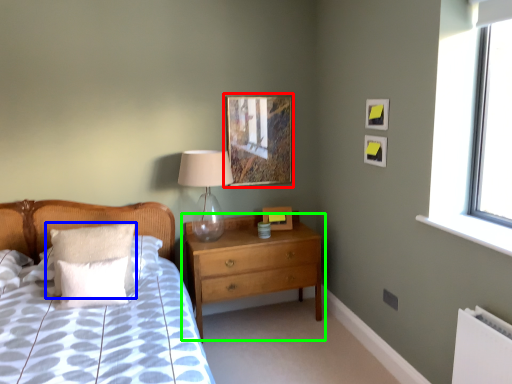
Question: Which object is positioned farthest from picture frame (highlighted by a red box)? Select from pillow (highlighted by a blue box) and chest of drawers (highlighted by a green box).

Choices:
 (A) pillow
 (B) chest of drawers

Answer: (A)